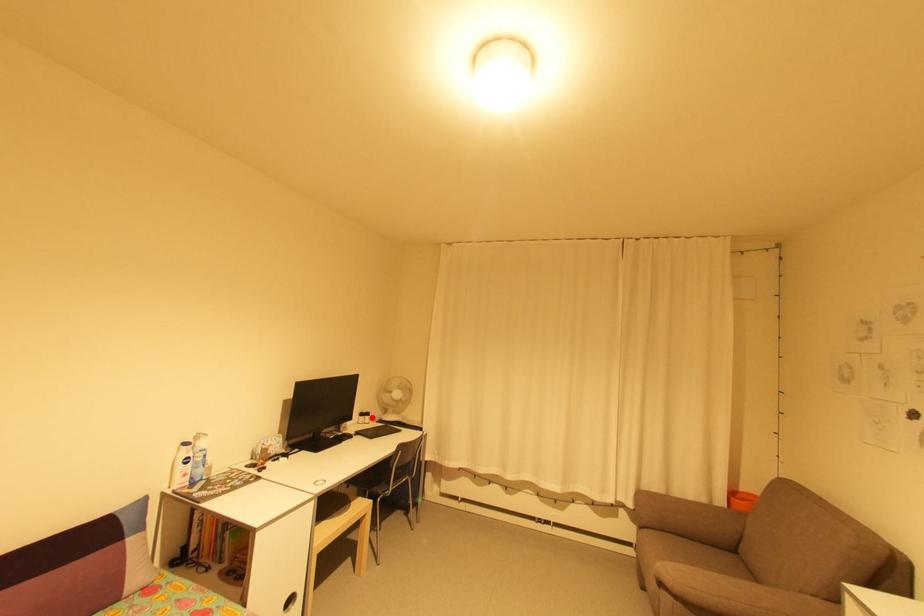
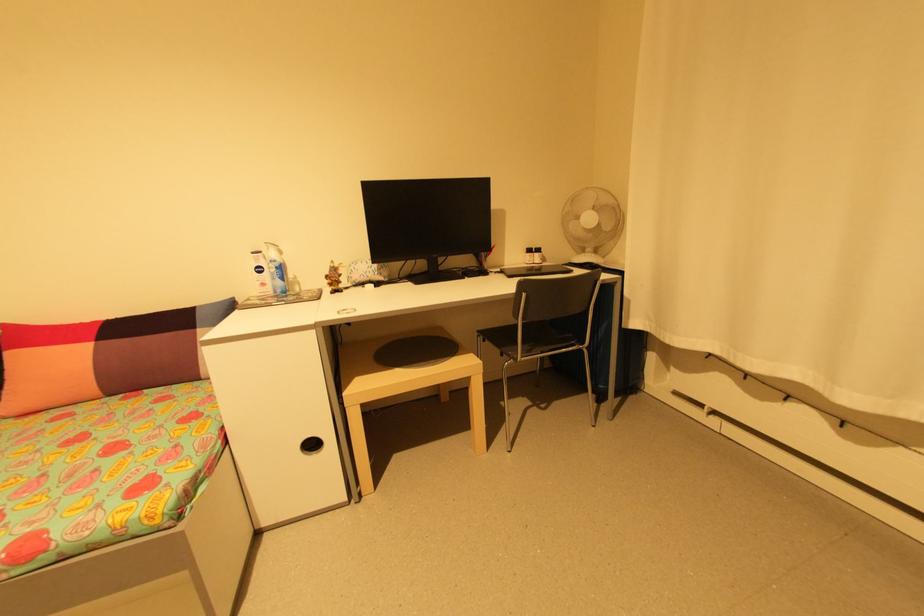
Locate, in the second image, the point that corresponds to the highlighted location in the first image.

(541, 254)